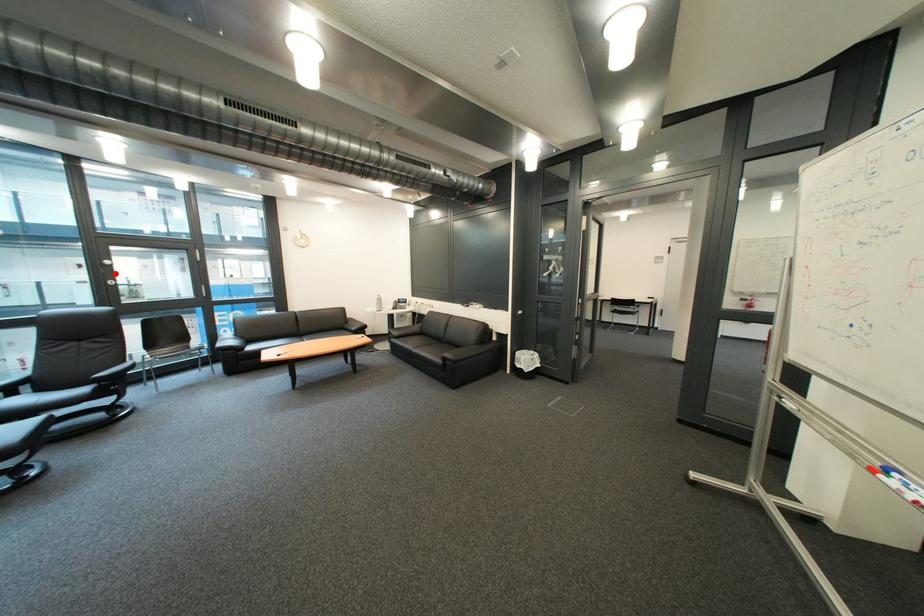
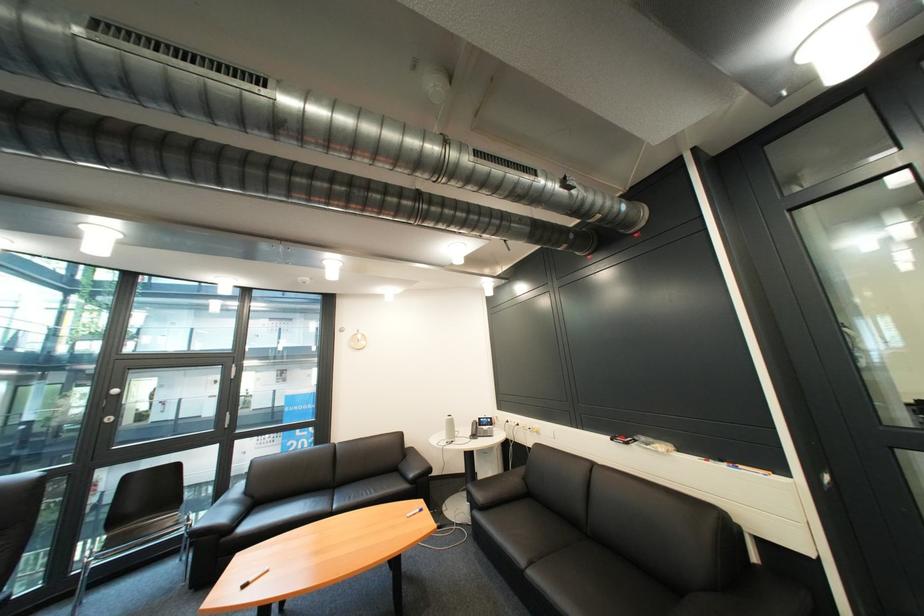
Question: I am providing you with two images of the same scene from different viewpoints. A red point is shown in image1. For the corresponding object point in image2, is it positioned nearer or farther from the camera?

Choices:
 (A) Nearer
 (B) Farther

Answer: (A)